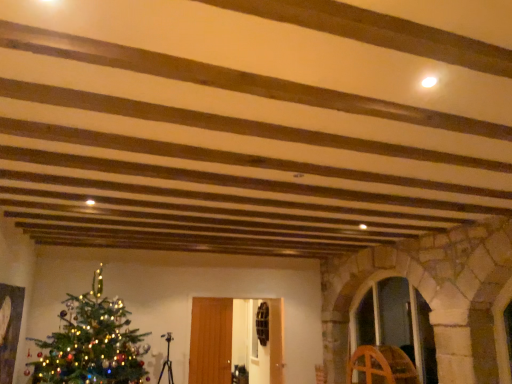
What do you see at coordinates (397, 323) in the screenshot?
I see `transparent glass door at center-right, which appears as the first glass door when viewed from the right` at bounding box center [397, 323].

The image size is (512, 384). I want to click on green matte christmas tree at lower left, so click(92, 342).

At what (x,y) coordinates should I click in order to perform the action: click on transparent glass door at center-right, which appears as the first glass door when viewed from the right. Please return your answer as a coordinate pair (x, y). The width and height of the screenshot is (512, 384). Looking at the image, I should click on pos(397,323).

Which of these two, wooden wheel at right or transparent glass door at center, acting as the second glass door starting from the right, is wider?

wooden wheel at right.

From their relative heights in the image, would you say wooden wheel at right is taller or shorter than transparent glass door at center, the first glass door viewed from the left?

wooden wheel at right is shorter than transparent glass door at center, the first glass door viewed from the left.

Between wooden wheel at right and transparent glass door at center, the first glass door viewed from the left, which one has smaller size?

Smaller between the two is transparent glass door at center, the first glass door viewed from the left.

From a real-world perspective, is wooden wheel at right above or below transparent glass door at center, acting as the second glass door starting from the right?

Clearly, from a real-world perspective, wooden wheel at right is below transparent glass door at center, acting as the second glass door starting from the right.

Between transparent glass door at center, the first glass door viewed from the left, and transparent glass door at center-right, which appears as the first glass door when viewed from the right, which one has more height?

With more height is transparent glass door at center-right, which appears as the first glass door when viewed from the right.

Can you confirm if transparent glass door at center, acting as the second glass door starting from the right, is positioned to the left of transparent glass door at center-right, acting as the 2th glass door starting from the left?

→ Yes, transparent glass door at center, acting as the second glass door starting from the right, is to the left of transparent glass door at center-right, acting as the 2th glass door starting from the left.

Is transparent glass door at center, the first glass door viewed from the left, positioned with its back to transparent glass door at center-right, which appears as the first glass door when viewed from the right?

No, transparent glass door at center, the first glass door viewed from the left,'s orientation is not away from transparent glass door at center-right, which appears as the first glass door when viewed from the right.

Is point (269, 302) closer or farther from the camera than point (104, 364)?

Clearly, point (269, 302) is more distant from the camera than point (104, 364).

Based on the photo, who is shorter, transparent glass door at center, acting as the second glass door starting from the right, or green matte christmas tree at lower left?

transparent glass door at center, acting as the second glass door starting from the right.

Which glass door is the 1st one when counting from the right side of the green matte christmas tree at lower left? Please provide its 2D coordinates.

[(211, 341)]

How many degrees apart are the facing directions of transparent glass door at center, acting as the second glass door starting from the right, and green matte christmas tree at lower left?

transparent glass door at center, acting as the second glass door starting from the right, and green matte christmas tree at lower left are facing 91.1 degrees away from each other.

Does wooden wheel at right have a greater height compared to green matte christmas tree at lower left?

No, wooden wheel at right is not taller than green matte christmas tree at lower left.

Are wooden wheel at right and green matte christmas tree at lower left far apart?

Indeed, wooden wheel at right is not near green matte christmas tree at lower left.

Is wooden wheel at right not inside green matte christmas tree at lower left?

Absolutely, wooden wheel at right is external to green matte christmas tree at lower left.

Between point (361, 352) and point (113, 348), which one is positioned in front?

Positioned in front is point (113, 348).

Is transparent glass door at center-right, acting as the 2th glass door starting from the left, not close to wooden wheel at right?

transparent glass door at center-right, acting as the 2th glass door starting from the left, is actually quite close to wooden wheel at right.

Could you tell me if transparent glass door at center-right, which appears as the first glass door when viewed from the right, is turned towards wooden wheel at right?

Yes, transparent glass door at center-right, which appears as the first glass door when viewed from the right, faces towards wooden wheel at right.

The height and width of the screenshot is (384, 512). What are the coordinates of `furniture on the left of transparent glass door at center-right, which appears as the first glass door when viewed from the right` in the screenshot? It's located at (382, 366).

What's the angular difference between green matte christmas tree at lower left and wooden wheel at right's facing directions?

The facing directions of green matte christmas tree at lower left and wooden wheel at right are 179 degrees apart.

From the image's perspective, relative to wooden wheel at right, is green matte christmas tree at lower left above or below?

green matte christmas tree at lower left is above wooden wheel at right.

Is green matte christmas tree at lower left wider or thinner than wooden wheel at right?

Clearly, green matte christmas tree at lower left has more width compared to wooden wheel at right.

Is green matte christmas tree at lower left at the left side of wooden wheel at right?

Correct, you'll find green matte christmas tree at lower left to the left of wooden wheel at right.

From the image's perspective, between green matte christmas tree at lower left and transparent glass door at center, acting as the second glass door starting from the right, which one is located above?

green matte christmas tree at lower left is shown above in the image.

This screenshot has height=384, width=512. In order to click on christmas tree in front of the transparent glass door at center, acting as the second glass door starting from the right in this screenshot , I will do `click(92, 342)`.

How different are the orientations of green matte christmas tree at lower left and transparent glass door at center, the first glass door viewed from the left, in degrees?

91.1 degrees separate the facing orientations of green matte christmas tree at lower left and transparent glass door at center, the first glass door viewed from the left.

Considering the positions of points (42, 382) and (232, 307), is point (42, 382) farther from camera compared to point (232, 307)?

No, it is not.

From the image's perspective, starting from the wooden wheel at right, which glass door is the 1st one above? Please provide its 2D coordinates.

[(211, 341)]

Locate an element on the screen. The image size is (512, 384). glass door on the left of the transparent glass door at center-right, acting as the 2th glass door starting from the left is located at coordinates (211, 341).

Estimate the real-world distances between objects in this image. Which object is closer to green matte christmas tree at lower left, wooden wheel at right or transparent glass door at center-right, acting as the 2th glass door starting from the left?

wooden wheel at right lies closer to green matte christmas tree at lower left than the other object.

From the image, which object appears to be farther from wooden wheel at right, transparent glass door at center-right, acting as the 2th glass door starting from the left, or transparent glass door at center, acting as the second glass door starting from the right?

transparent glass door at center, acting as the second glass door starting from the right, is further to wooden wheel at right.

Estimate the real-world distances between objects in this image. Which object is further from transparent glass door at center-right, acting as the 2th glass door starting from the left, green matte christmas tree at lower left or transparent glass door at center, the first glass door viewed from the left?

green matte christmas tree at lower left lies further to transparent glass door at center-right, acting as the 2th glass door starting from the left, than the other object.

From the image, which object appears to be nearer to transparent glass door at center-right, acting as the 2th glass door starting from the left, wooden wheel at right or green matte christmas tree at lower left?

wooden wheel at right is closer to transparent glass door at center-right, acting as the 2th glass door starting from the left.

From the image, which object appears to be farther from transparent glass door at center, acting as the second glass door starting from the right, wooden wheel at right or green matte christmas tree at lower left?

Based on the image, wooden wheel at right appears to be further to transparent glass door at center, acting as the second glass door starting from the right.

Considering their positions, is green matte christmas tree at lower left positioned closer to transparent glass door at center, the first glass door viewed from the left, than wooden wheel at right?

green matte christmas tree at lower left lies closer to transparent glass door at center, the first glass door viewed from the left, than the other object.

Considering their positions, is green matte christmas tree at lower left positioned closer to wooden wheel at right than transparent glass door at center, the first glass door viewed from the left?

Among the two, transparent glass door at center, the first glass door viewed from the left, is located nearer to wooden wheel at right.

Looking at the image, which one is located further to green matte christmas tree at lower left, wooden wheel at right or transparent glass door at center, acting as the second glass door starting from the right?

The object further to green matte christmas tree at lower left is wooden wheel at right.

The image size is (512, 384). I want to click on furniture between green matte christmas tree at lower left and transparent glass door at center, acting as the second glass door starting from the right, from front to back, so click(382, 366).

The height and width of the screenshot is (384, 512). In order to click on glass door situated between green matte christmas tree at lower left and transparent glass door at center-right, acting as the 2th glass door starting from the left, from left to right in this screenshot , I will do `click(211, 341)`.

The image size is (512, 384). What are the coordinates of `furniture between transparent glass door at center, the first glass door viewed from the left, and transparent glass door at center-right, which appears as the first glass door when viewed from the right, from left to right` in the screenshot? It's located at (382, 366).

Where is `furniture situated between green matte christmas tree at lower left and transparent glass door at center-right, which appears as the first glass door when viewed from the right, from left to right`? This screenshot has width=512, height=384. furniture situated between green matte christmas tree at lower left and transparent glass door at center-right, which appears as the first glass door when viewed from the right, from left to right is located at coordinates (382, 366).